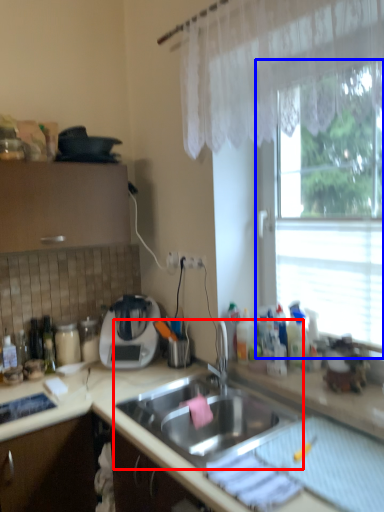
Question: Among these objects, which one is nearest to the camera, sink (highlighted by a red box) or window (highlighted by a blue box)?

Choices:
 (A) sink
 (B) window

Answer: (A)